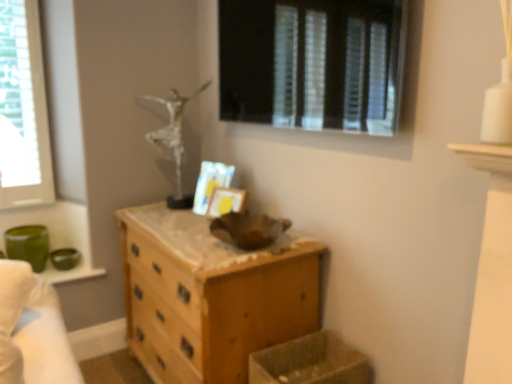
Where is `wooden chest of drawers at center`? The height and width of the screenshot is (384, 512). wooden chest of drawers at center is located at coordinates (211, 295).

In order to face wooden chest of drawers at center, should I rotate leftwards or rightwards?

To align with it, rotate left about 6.605°.

In order to click on green fabric bed at left in this screenshot , I will do `click(32, 330)`.

Locate an element on the screen. The width and height of the screenshot is (512, 384). wooden chest of drawers at center is located at coordinates (211, 295).

From the image's perspective, between translucent plastic crate at lower center and clear glass window at left, which appears as the 2th window when viewed from the front, which one is located above?

clear glass window at left, which appears as the 2th window when viewed from the front, is shown above in the image.

Is point (312, 341) closer to camera compared to point (19, 169)?

Yes, it is in front of point (19, 169).

How many degrees apart are the facing directions of translucent plastic crate at lower center and clear glass window at left, which appears as the second window when viewed from the right?

90.4 degrees.

Is translucent plastic crate at lower center next to clear glass window at left, the first window when ordered from left to right?

No, translucent plastic crate at lower center is not next to clear glass window at left, the first window when ordered from left to right.

Locate an element on the screen. chest of drawers that is on the right side of clear glass window at left, the first window when ordered from left to right is located at coordinates (211, 295).

From a real-world perspective, is clear glass window at left, positioned as the 1th window in back-to-front order, under wooden chest of drawers at center?

No, from a real-world perspective, clear glass window at left, positioned as the 1th window in back-to-front order, is not beneath wooden chest of drawers at center.

Is clear glass window at left, which appears as the 2th window when viewed from the front, positioned with its back to wooden chest of drawers at center?

clear glass window at left, which appears as the 2th window when viewed from the front, is not turned away from wooden chest of drawers at center.

Who is shorter, clear glass window at left, which appears as the 2th window when viewed from the front, or wooden chest of drawers at center?

wooden chest of drawers at center.

From the image's perspective, which is below, green fabric bed at left or wooden picture frame at center?

green fabric bed at left, from the image's perspective.

Can you confirm if green fabric bed at left is thinner than wooden picture frame at center?

Incorrect, the width of green fabric bed at left is not less than that of wooden picture frame at center.

Are green fabric bed at left and wooden picture frame at center far apart?

No, green fabric bed at left is not far away from wooden picture frame at center.

Can transparent glass window at upper center, the second window in the back-to-front sequence, be found inside wooden picture frame at center?

No, transparent glass window at upper center, the second window in the back-to-front sequence, is not a part of wooden picture frame at center.

Considering the positions of point (211, 213) and point (242, 117), is point (211, 213) closer or farther from the camera than point (242, 117)?

Point (211, 213).

Is clear glass window at left, the first window when ordered from left to right, oriented towards translucent plastic crate at lower center?

No, clear glass window at left, the first window when ordered from left to right, is not facing towards translucent plastic crate at lower center.

Based on the photo, considering the sizes of objects clear glass window at left, positioned as the 1th window in back-to-front order, and translucent plastic crate at lower center in the image provided, who is smaller, clear glass window at left, positioned as the 1th window in back-to-front order, or translucent plastic crate at lower center?

translucent plastic crate at lower center is smaller.

From a real-world perspective, is clear glass window at left, positioned as the 1th window in back-to-front order, located higher than translucent plastic crate at lower center?

Yes.

Based on their positions, is clear glass window at left, which appears as the 2th window when viewed from the front, located to the left or right of translucent plastic crate at lower center?

Clearly, clear glass window at left, which appears as the 2th window when viewed from the front, is on the left of translucent plastic crate at lower center in the image.

Who is shorter, green fabric bed at left or wooden chest of drawers at center?

green fabric bed at left is shorter.

Is green fabric bed at left far away from wooden chest of drawers at center?

green fabric bed at left is actually quite close to wooden chest of drawers at center.

Which is correct: green fabric bed at left is inside wooden chest of drawers at center, or outside of it?

green fabric bed at left exists outside the volume of wooden chest of drawers at center.

In the image, is wooden picture frame at center positioned in front of or behind wooden chest of drawers at center?

In the image, wooden picture frame at center appears behind wooden chest of drawers at center.

Does point (239, 205) come farther from viewer compared to point (262, 348)?

That is True.

Is wooden picture frame at center touching wooden chest of drawers at center?

There is a gap between wooden picture frame at center and wooden chest of drawers at center.

Where is `chest of drawers below the wooden picture frame at center (from a real-world perspective)`? The image size is (512, 384). chest of drawers below the wooden picture frame at center (from a real-world perspective) is located at coordinates (211, 295).

Find the location of a particular element. Image resolution: width=512 pixels, height=384 pixels. crate in front of the clear glass window at left, which appears as the second window when viewed from the right is located at coordinates (311, 362).

Identify the location of chest of drawers located on the right of clear glass window at left, positioned as the 1th window in back-to-front order. This screenshot has height=384, width=512. (211, 295).

Which object lies nearer to the anchor point translucent plastic crate at lower center, wooden chest of drawers at center or transparent glass window at upper center, placed as the 1th window when sorted from front to back?

The object closer to translucent plastic crate at lower center is wooden chest of drawers at center.

Looking at the image, which one is located closer to wooden chest of drawers at center, wooden picture frame at center or green fabric bed at left?

wooden picture frame at center.

Looking at the image, which one is located closer to green fabric bed at left, wooden chest of drawers at center or translucent plastic crate at lower center?

Based on the image, wooden chest of drawers at center appears to be nearer to green fabric bed at left.

Estimate the real-world distances between objects in this image. Which object is closer to wooden chest of drawers at center, wooden picture frame at center or clear glass window at left, the first window when ordered from left to right?

wooden picture frame at center is closer to wooden chest of drawers at center.

Which object lies further to the anchor point translucent plastic crate at lower center, green fabric bed at left or wooden chest of drawers at center?

green fabric bed at left.

From the image, which object appears to be nearer to green fabric bed at left, wooden picture frame at center or transparent glass window at upper center, the second window in the back-to-front sequence?

wooden picture frame at center lies closer to green fabric bed at left than the other object.

When comparing their distances from transparent glass window at upper center, placed as the 1th window when sorted from front to back, does wooden picture frame at center or clear glass window at left, which appears as the second window when viewed from the right, seem closer?

The object closer to transparent glass window at upper center, placed as the 1th window when sorted from front to back, is wooden picture frame at center.

Based on their spatial positions, is clear glass window at left, which appears as the 2th window when viewed from the front, or green fabric bed at left closer to wooden chest of drawers at center?

green fabric bed at left is closer to wooden chest of drawers at center.

Where is `bed that lies between clear glass window at left, which appears as the second window when viewed from the right, and wooden chest of drawers at center from top to bottom`? The image size is (512, 384). bed that lies between clear glass window at left, which appears as the second window when viewed from the right, and wooden chest of drawers at center from top to bottom is located at coordinates (32, 330).

Where is `picture frame between green fabric bed at left and translucent plastic crate at lower center`? The width and height of the screenshot is (512, 384). picture frame between green fabric bed at left and translucent plastic crate at lower center is located at coordinates (225, 201).

The height and width of the screenshot is (384, 512). In order to click on chest of drawers between wooden picture frame at center and translucent plastic crate at lower center in the up-down direction in this screenshot , I will do `click(211, 295)`.

You are a GUI agent. You are given a task and a screenshot of the screen. Output one action in this format:
    pyautogui.click(x=<x>, y=<y>)
    Task: Click on the chest of drawers that lies between transparent glass window at upper center, the second window in the back-to-front sequence, and translucent plastic crate at lower center from top to bottom
    
    Given the screenshot: What is the action you would take?
    pyautogui.click(x=211, y=295)